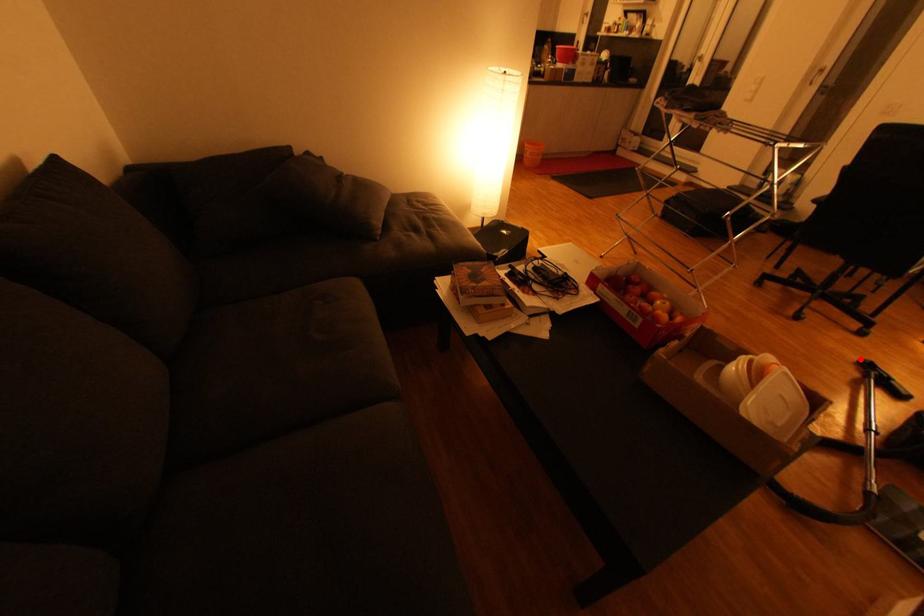
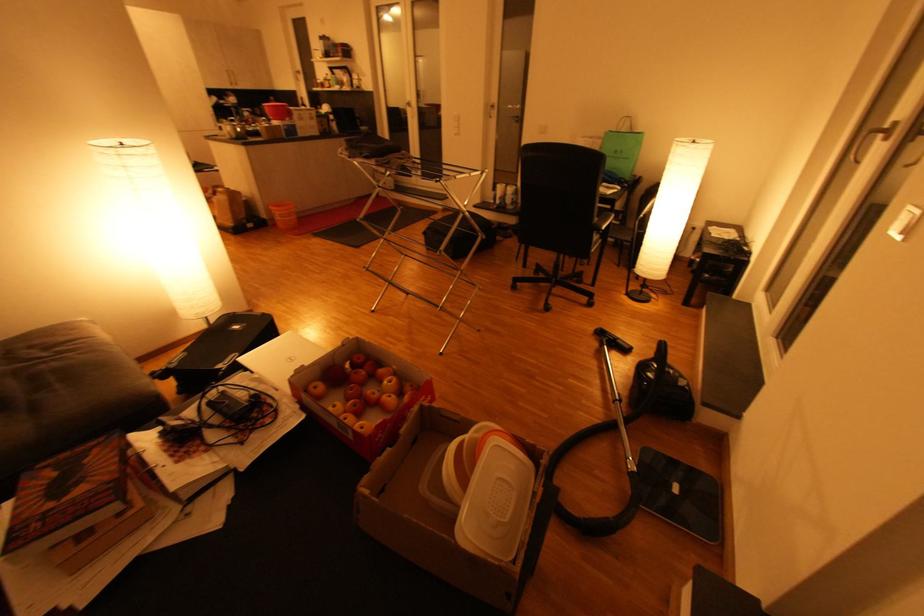
Where in the second image is the point corresponding to the highlighted location from the first image?

(597, 330)